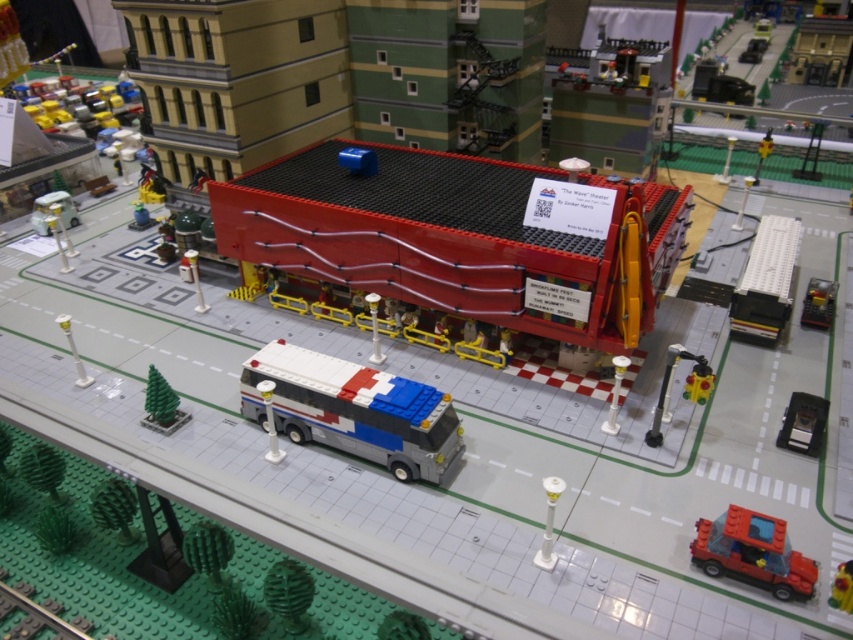
Does point (461, 429) come farther from viewer compared to point (679, 344)?

No, it is in front of (679, 344).

Between brick-patterned bus at center and translucent yellow traffic light at lower right, which one is positioned higher?

translucent yellow traffic light at lower right is above.

Describe the element at coordinates (354, 410) in the screenshot. I see `brick-patterned bus at center` at that location.

You are a GUI agent. You are given a task and a screenshot of the screen. Output one action in this format:
    pyautogui.click(x=<x>, y=<y>)
    Task: Click on the brick-patterned bus at center
    
    Given the screenshot: What is the action you would take?
    pyautogui.click(x=354, y=410)

Which is more to the right, brick-patterned bus at center or green rubber plant at lower center?

brick-patterned bus at center is more to the right.

Does brick-patterned bus at center have a larger size compared to green rubber plant at lower center?

Yes.

Between point (357, 424) and point (305, 609), which one is positioned in front?

Positioned in front is point (305, 609).

Find the location of a particular element. brick-patterned bus at center is located at coordinates (354, 410).

Which of these two, brick red car at lower right or black plastic car at lower right, stands taller?

Standing taller between the two is brick red car at lower right.

Between point (755, 548) and point (802, 408), which one is positioned in front?

Positioned in front is point (755, 548).

In order to click on brick red car at lower right in this screenshot , I will do `click(753, 554)`.